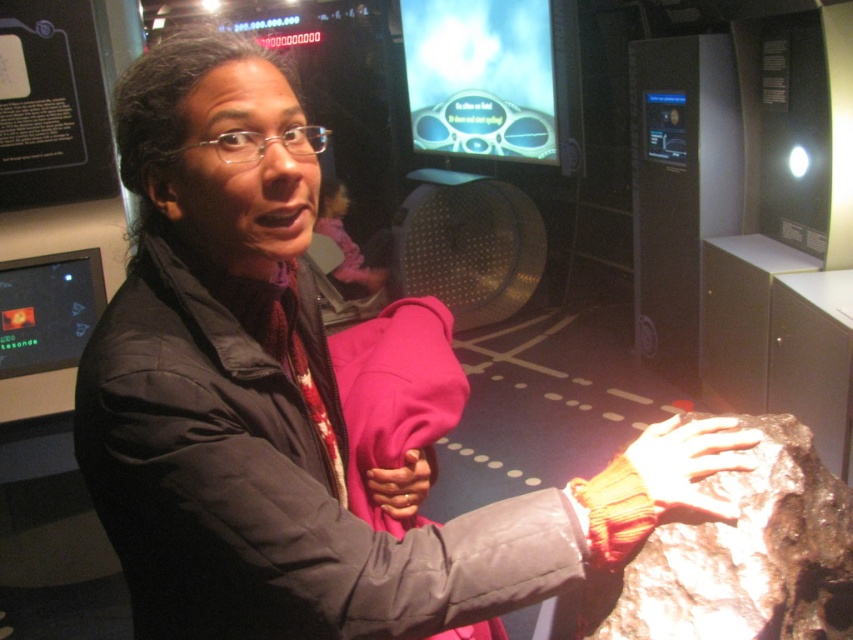
Between black puffy jacket at center and matte orange glove at center, which one is positioned higher?

black puffy jacket at center is above.

Does point (376, 541) lie behind point (401, 515)?

No.

The height and width of the screenshot is (640, 853). In order to click on black puffy jacket at center in this screenshot , I will do `click(265, 492)`.

Is sandy brown leather hand at center shorter than matte orange glove at center?

Incorrect, sandy brown leather hand at center's height does not fall short of matte orange glove at center's.

Is sandy brown leather hand at center bigger than matte orange glove at center?

Correct, sandy brown leather hand at center is larger in size than matte orange glove at center.

Who is more forward, (x=641, y=464) or (x=415, y=480)?

Point (x=641, y=464) is more forward.

You are a GUI agent. You are given a task and a screenshot of the screen. Output one action in this format:
    pyautogui.click(x=<x>, y=<y>)
    Task: Click on the sandy brown leather hand at center
    This screenshot has width=853, height=640.
    Given the screenshot: What is the action you would take?
    pyautogui.click(x=689, y=465)

Who is more forward, (194, 358) or (677, 435)?

Point (194, 358)

Between black puffy jacket at center and sandy brown leather hand at center, which one is positioned higher?

Positioned higher is sandy brown leather hand at center.

Which is in front, point (267, 378) or point (651, 435)?

Point (267, 378)

At what (x,y) coordinates should I click in order to perform the action: click on black puffy jacket at center. Please return your answer as a coordinate pair (x, y). The height and width of the screenshot is (640, 853). Looking at the image, I should click on (x=265, y=492).